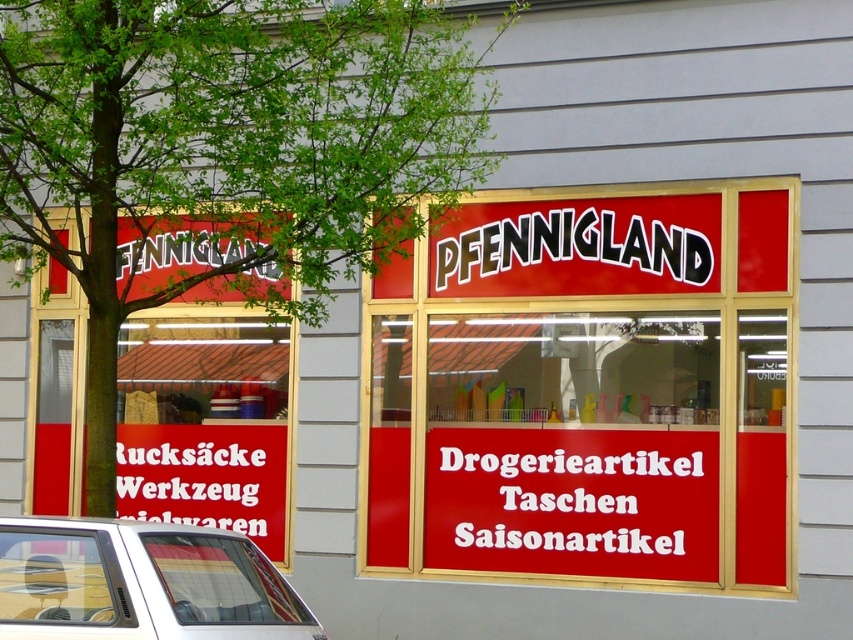
You are standing in front of the storefront and want to take a photo of the green leafy tree at upper left. Where should you aim your camera to capture it in the frame?

The green leafy tree at upper left is located at point 0.241 on the x axis and 0.266 on the y axis, so you should aim your camera towards the upper left corner of the storefront window at those coordinates to capture it in the frame.

You are standing in front of the storefront and want to find the section for Drogerieartikel. According to the image, which signboard should you look at, the matte red signboard at center or the red matte signboard at left?

The Drogerieartikel is listed on the right section, which corresponds to the matte red signboard at center. Therefore, you should look at the matte red signboard at center.

You are standing in front of the storefront and want to locate the green leafy tree at upper left and the red matte signboard at left. According to the scene, which one is positioned to the right?

The green leafy tree at upper left is positioned to the right of the red matte signboard at left.